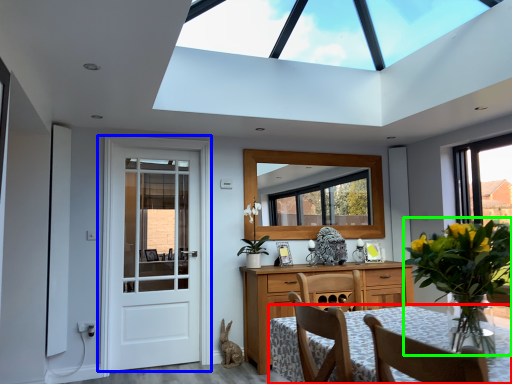
Question: Based on their relative distances, which object is farther from table (highlighted by a red box)? Choose from door (highlighted by a blue box) and floral arrangement (highlighted by a green box).

Choices:
 (A) door
 (B) floral arrangement

Answer: (A)